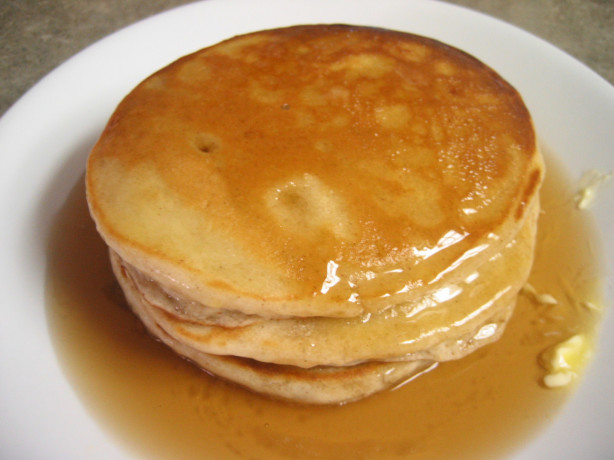
The width and height of the screenshot is (614, 460). In order to click on granite countertop in this screenshot , I will do `click(573, 34)`, `click(25, 26)`.